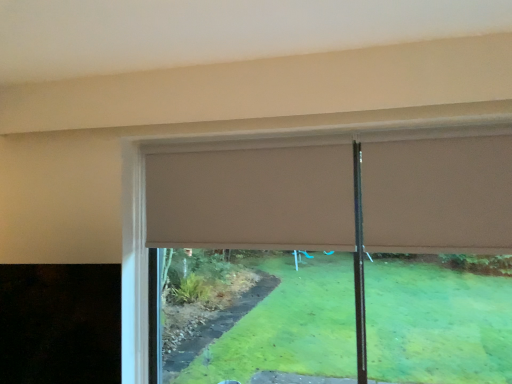
Question: Choose the correct answer: Is beige fabric curtain at upper center, the second curtain when ordered from right to left, inside beige fabric curtain at upper center, which ranks as the 2th curtain in back-to-front order, or outside it?

Choices:
 (A) outside
 (B) inside

Answer: (A)

Question: In terms of width, does beige fabric curtain at upper center, the first curtain from the left, look wider or thinner when compared to beige fabric curtain at upper center, placed as the 2th curtain when sorted from left to right?

Choices:
 (A) thin
 (B) wide

Answer: (A)

Question: Is point (313, 201) closer or farther from the camera than point (368, 162)?

Choices:
 (A) closer
 (B) farther

Answer: (B)

Question: Is beige fabric curtain at upper center, which ranks as the 2th curtain in back-to-front order, spatially inside beige fabric curtain at upper center, which ranks as the second curtain in front-to-back order, or outside of it?

Choices:
 (A) inside
 (B) outside

Answer: (B)

Question: From the image's perspective, is beige fabric curtain at upper center, which ranks as the 2th curtain in back-to-front order, positioned above or below beige fabric curtain at upper center, the second curtain when ordered from right to left?

Choices:
 (A) below
 (B) above

Answer: (B)

Question: In the image, is beige fabric curtain at upper center, which appears as the first curtain when viewed from the front, positioned in front of or behind beige fabric curtain at upper center, the first curtain from the left?

Choices:
 (A) behind
 (B) front

Answer: (B)

Question: Considering the positions of beige fabric curtain at upper center, which ranks as the 2th curtain in back-to-front order, and beige fabric curtain at upper center, the second curtain when ordered from right to left, in the image, is beige fabric curtain at upper center, which ranks as the 2th curtain in back-to-front order, taller or shorter than beige fabric curtain at upper center, the second curtain when ordered from right to left,?

Choices:
 (A) tall
 (B) short

Answer: (B)